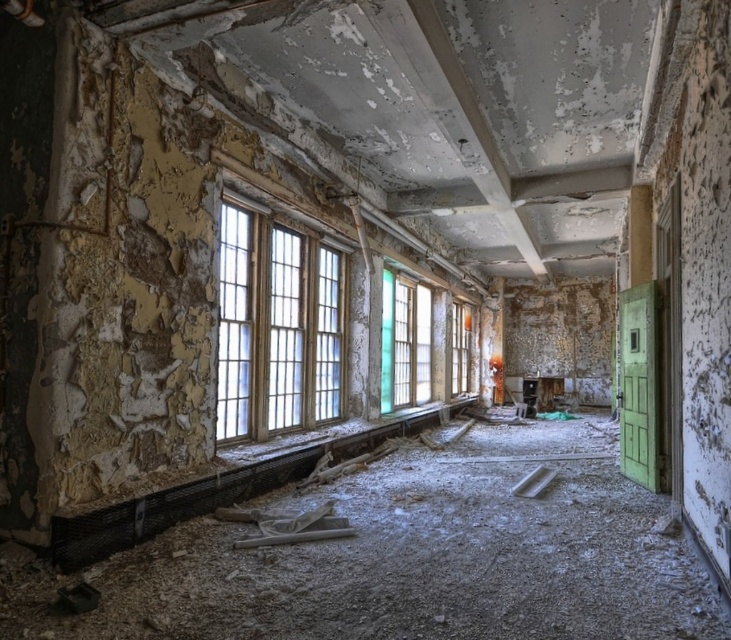
You are standing inside the abandoned space and want to look outside through the windows. Which window, the clear glass window at center or the translucent glass window at center, offers a better view?

The clear glass window at center is closer to the viewer than the translucent glass window at center, so it offers a better view because being closer allows for a clearer perspective despite the translucence of the other window.

You are a construction worker assessing the damage in this abandoned space. You notice two windows at the center. Which window, the clear glass window at center or the translucent glass window at center, has a larger size?

The clear glass window at center is bigger than the translucent glass window at center, so the clear glass window at center has a larger size.

You are a construction worker needing to move a 9 meter long steel beam from the clear glass window at center to the translucent glass window at center. Can you move it without bending the beam?

The clear glass window at center and translucent glass window at center are 8.56 meters apart from each other, so yes, the 9 meter long steel beam can be moved between them without bending since the distance is sufficient.